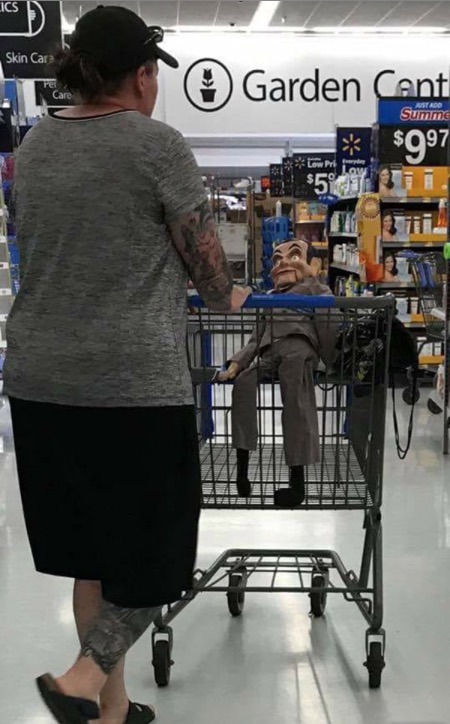
Locate an element on the screen. This screenshot has height=724, width=450. white floor is located at coordinates (304, 699).